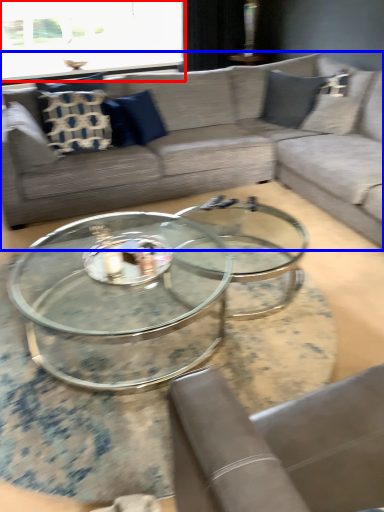
Question: Which object appears farthest to the camera in this image, window screen (highlighted by a red box) or studio couch (highlighted by a blue box)?

Choices:
 (A) window screen
 (B) studio couch

Answer: (A)